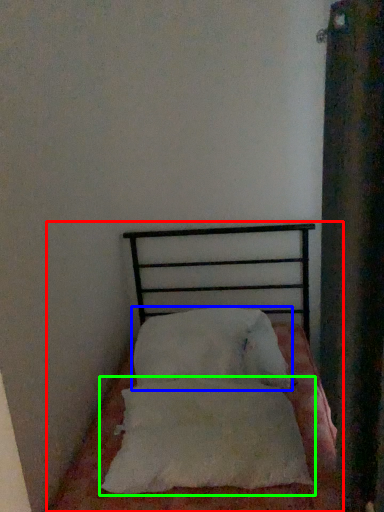
Question: Based on their relative distances, which object is nearer to bed (highlighted by a red box)? Choose from pillow (highlighted by a blue box) and pillow (highlighted by a green box).

Choices:
 (A) pillow
 (B) pillow

Answer: (B)